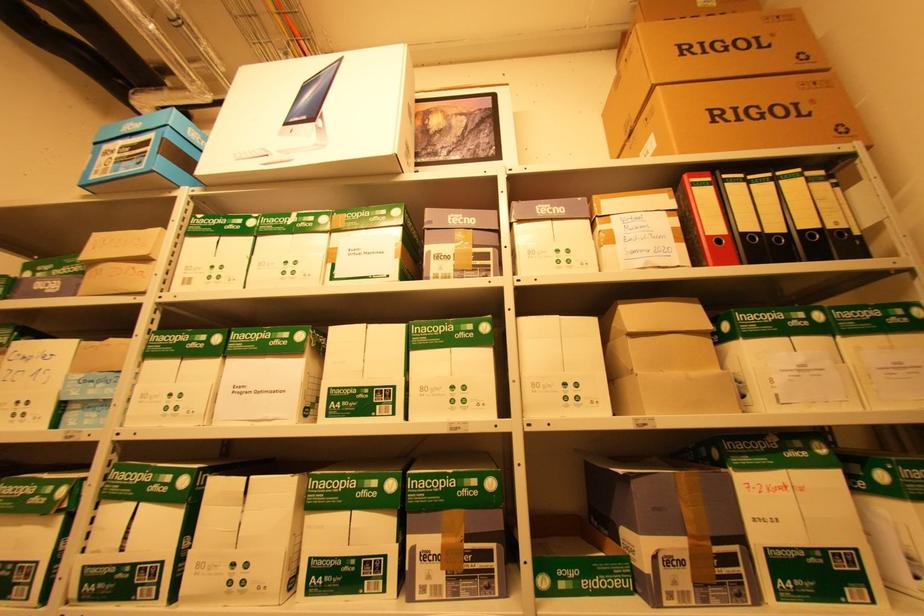
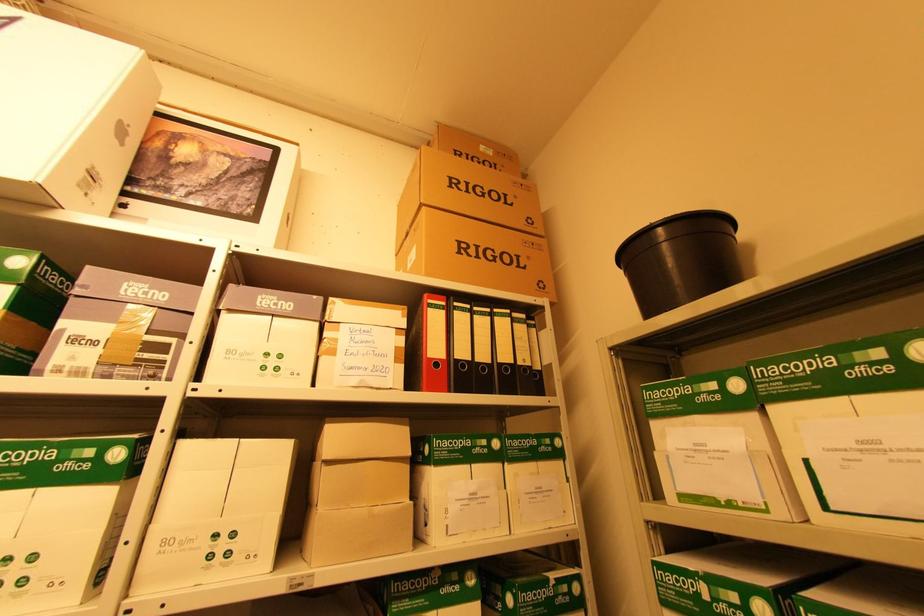
Question: The images are taken continuously from a first-person perspective. In which direction are you moving?

Choices:
 (A) Left
 (B) Right
 (C) Forward
 (D) Backward

Answer: (B)